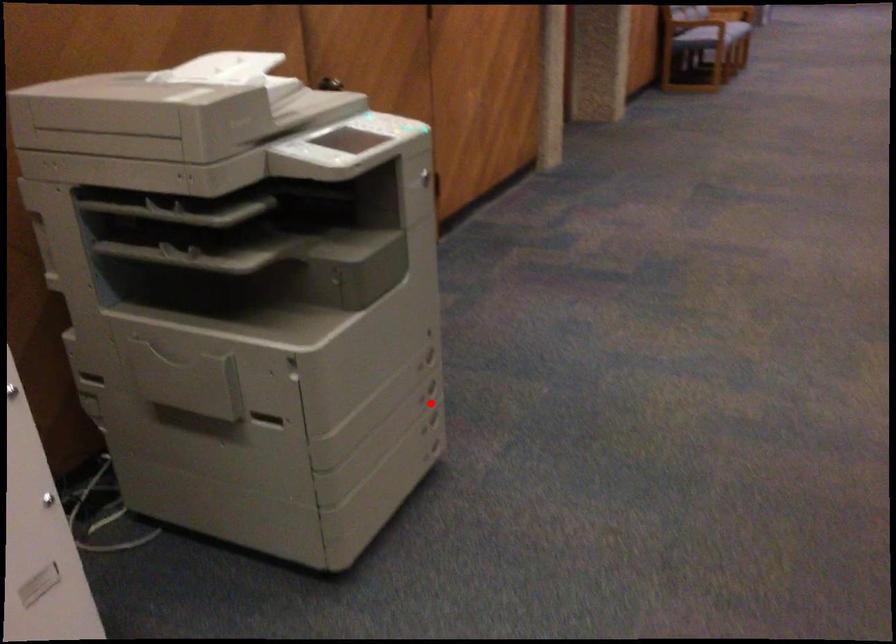
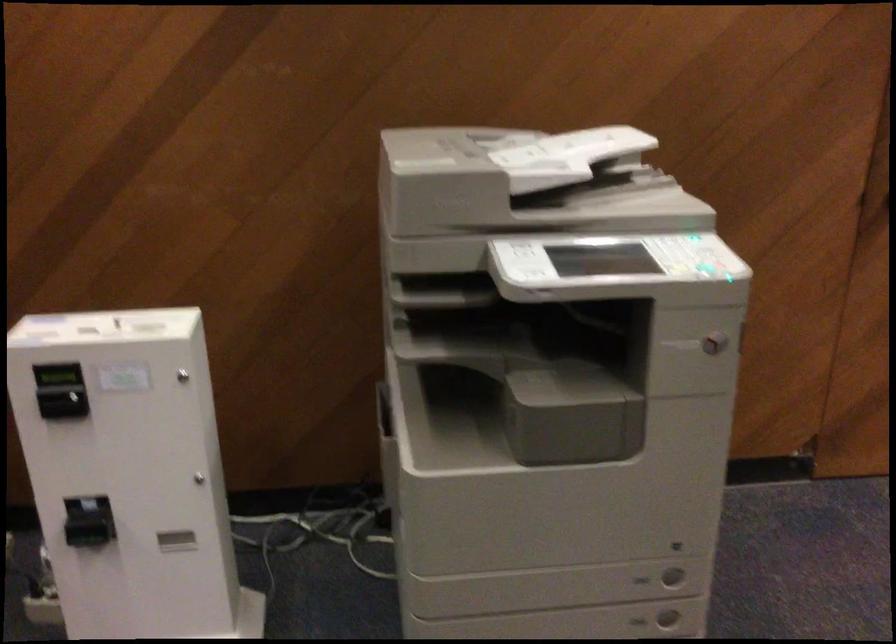
Question: A red point is marked in image1. In image2, is the corresponding 3D point closer to the camera or farther? Reply with the corresponding letter.

Choices:
 (A) The corresponding 3D point is closer.
 (B) The corresponding 3D point is farther.

Answer: (A)